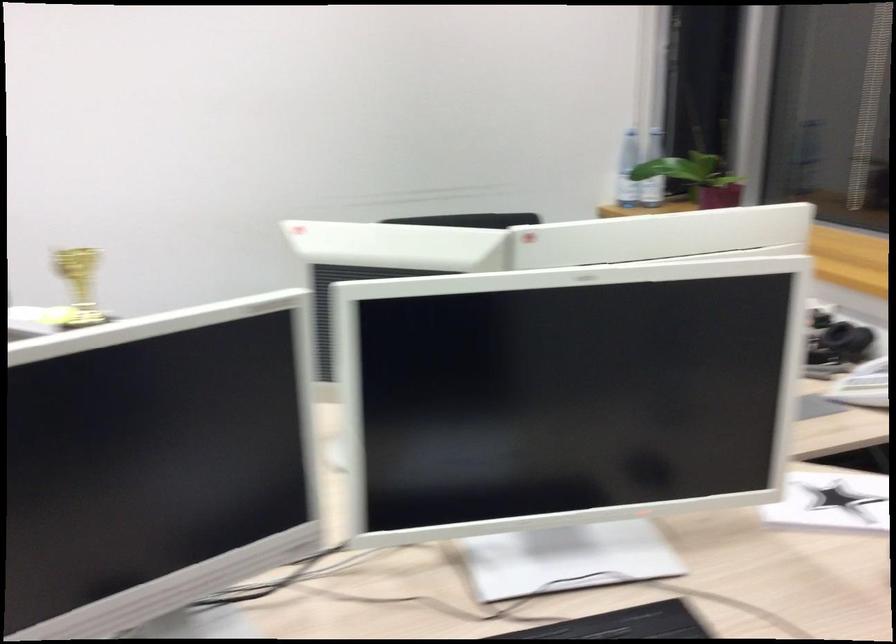
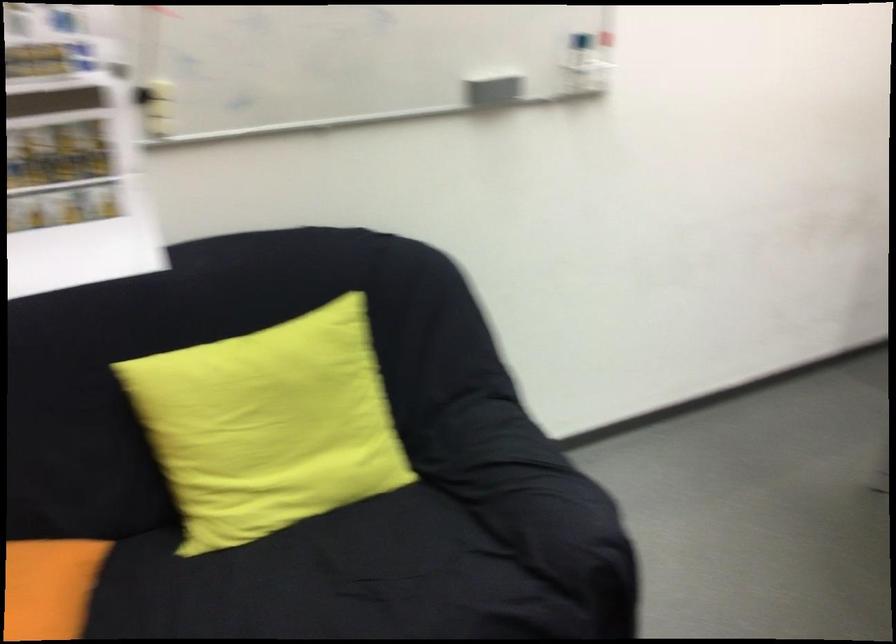
Question: Which direction would the cameraman need to move to produce the second image? Reply with the corresponding letter.

Choices:
 (A) Left
 (B) Right
 (C) Forward
 (D) Backward

Answer: (A)